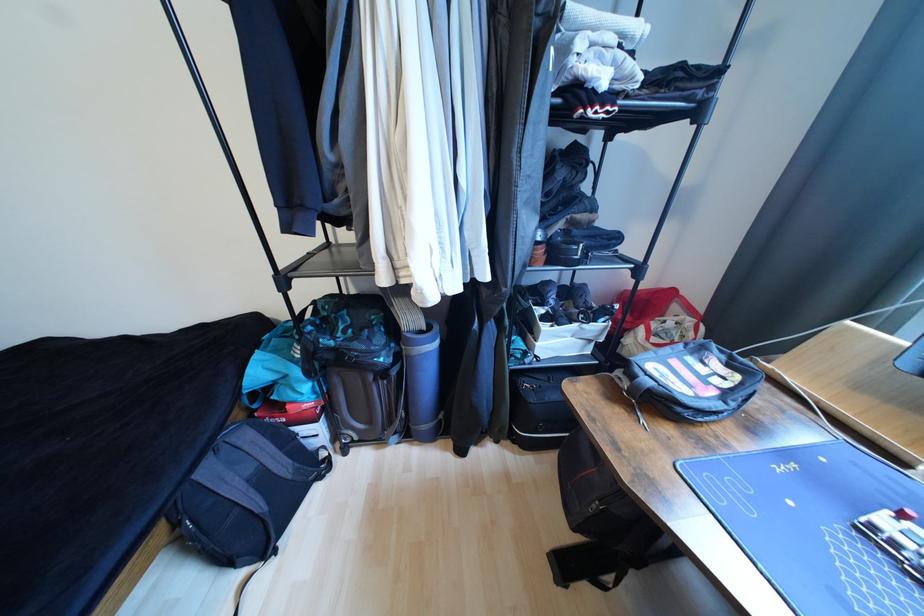
Locate an element on the screen. This screenshot has width=924, height=616. white storage bin is located at coordinates (562, 339).